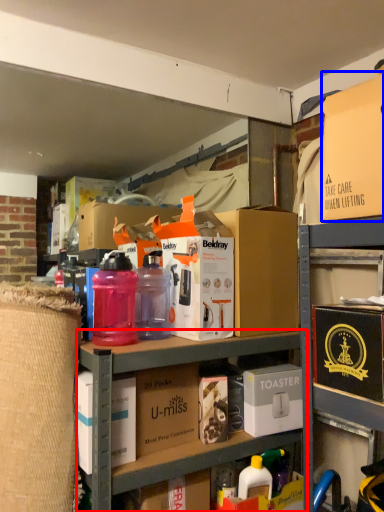
Question: Among these objects, which one is farthest to the camera, shelf (highlighted by a red box) or box (highlighted by a blue box)?

Choices:
 (A) shelf
 (B) box

Answer: (A)